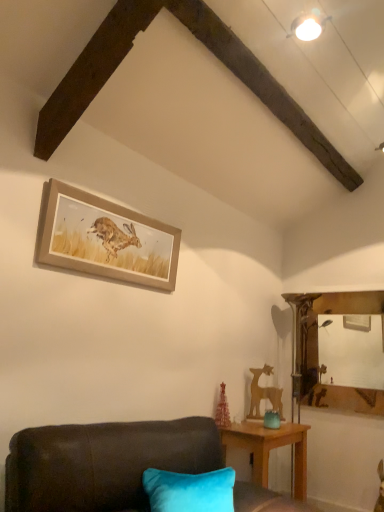
Question: Would you say teal glass jar at lower right contains wooden table at lower right?

Choices:
 (A) no
 (B) yes

Answer: (A)

Question: Is teal glass jar at lower right touching wooden table at lower right?

Choices:
 (A) yes
 (B) no

Answer: (B)

Question: Is teal glass jar at lower right taller than wooden table at lower right?

Choices:
 (A) yes
 (B) no

Answer: (B)

Question: Could you tell me if teal glass jar at lower right is turned towards wooden table at lower right?

Choices:
 (A) no
 (B) yes

Answer: (A)

Question: Is teal glass jar at lower right thinner than wooden table at lower right?

Choices:
 (A) no
 (B) yes

Answer: (B)

Question: In terms of width, does wooden table at lower right look wider or thinner when compared to wooden deer at right?

Choices:
 (A) thin
 (B) wide

Answer: (B)

Question: Considering their positions, is wooden table at lower right located in front of or behind wooden deer at right?

Choices:
 (A) behind
 (B) front

Answer: (B)

Question: Considering the positions of wooden table at lower right and wooden deer at right in the image, is wooden table at lower right bigger or smaller than wooden deer at right?

Choices:
 (A) big
 (B) small

Answer: (A)

Question: In terms of height, does wooden table at lower right look taller or shorter compared to wooden deer at right?

Choices:
 (A) tall
 (B) short

Answer: (A)

Question: Is wooden table at lower right situated inside velvet dark brown couch at lower left or outside?

Choices:
 (A) outside
 (B) inside

Answer: (A)

Question: From the image's perspective, relative to velvet dark brown couch at lower left, is wooden table at lower right above or below?

Choices:
 (A) below
 (B) above

Answer: (A)

Question: Considering the positions of wooden table at lower right and velvet dark brown couch at lower left in the image, is wooden table at lower right bigger or smaller than velvet dark brown couch at lower left?

Choices:
 (A) big
 (B) small

Answer: (B)

Question: Is wooden table at lower right wider or thinner than velvet dark brown couch at lower left?

Choices:
 (A) thin
 (B) wide

Answer: (A)

Question: In terms of height, does wooden deer at right look taller or shorter compared to wooden framed print of hare at upper center?

Choices:
 (A) short
 (B) tall

Answer: (B)

Question: Considering their positions, is wooden deer at right located in front of or behind wooden framed print of hare at upper center?

Choices:
 (A) behind
 (B) front

Answer: (A)